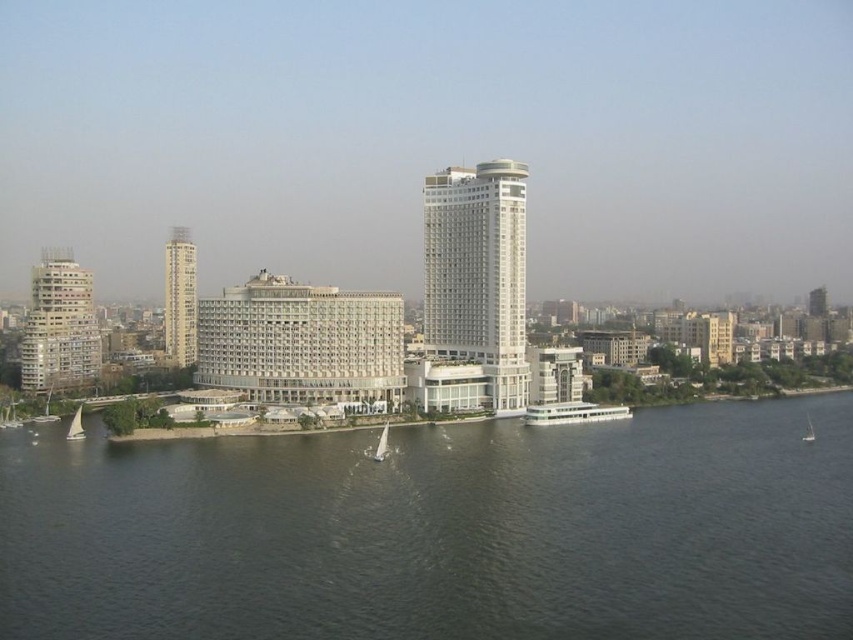
Question: Which point appears closest to the camera in this image?

Choices:
 (A) (54, 378)
 (B) (383, 435)

Answer: (B)

Question: Which of the following is the farthest from the observer?

Choices:
 (A) (73, 420)
 (B) (180, 227)
 (C) (463, 289)
 (D) (461, 432)

Answer: (B)

Question: Is matte beige building at left below white sailboat at lower right?

Choices:
 (A) yes
 (B) no

Answer: (B)

Question: Does matte beige building at left appear on the right side of smooth beige tower at left?

Choices:
 (A) yes
 (B) no

Answer: (B)

Question: Does dark gray water at center have a greater width compared to white glossy building at center?

Choices:
 (A) no
 (B) yes

Answer: (B)

Question: Which of the following is the farthest from the observer?

Choices:
 (A) smooth beige tower at left
 (B) matte beige building at left
 (C) white sailboat at lower right

Answer: (A)